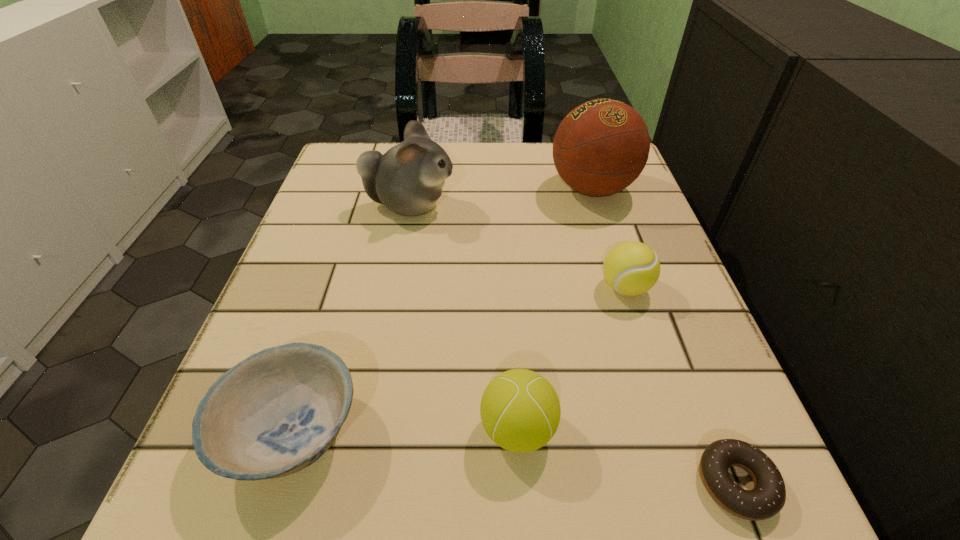
Find the location of `vacant region that satisfies the following two spatial constraints: 1. on the back side of the fifth tallest object; 2. on the left side of the basketball`. vacant region that satisfies the following two spatial constraints: 1. on the back side of the fifth tallest object; 2. on the left side of the basketball is located at coordinates (369, 188).

Identify the location of free location that satisfies the following two spatial constraints: 1. on the face of the fifth shortest object; 2. on the right side of the farther tennis ball. Image resolution: width=960 pixels, height=540 pixels. (394, 287).

Identify the location of free location that satisfies the following two spatial constraints: 1. on the back side of the basketball; 2. on the left side of the bowl. This screenshot has height=540, width=960. (369, 188).